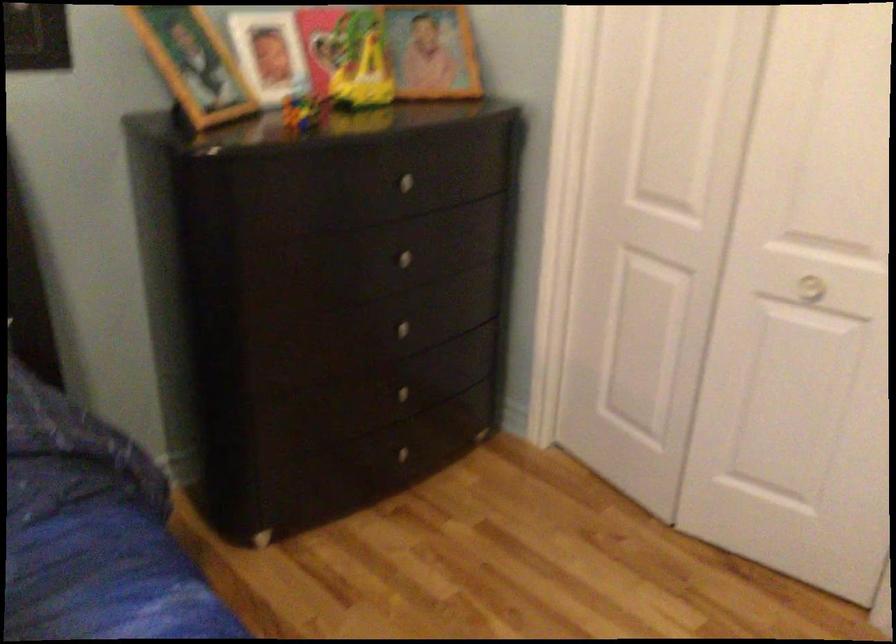
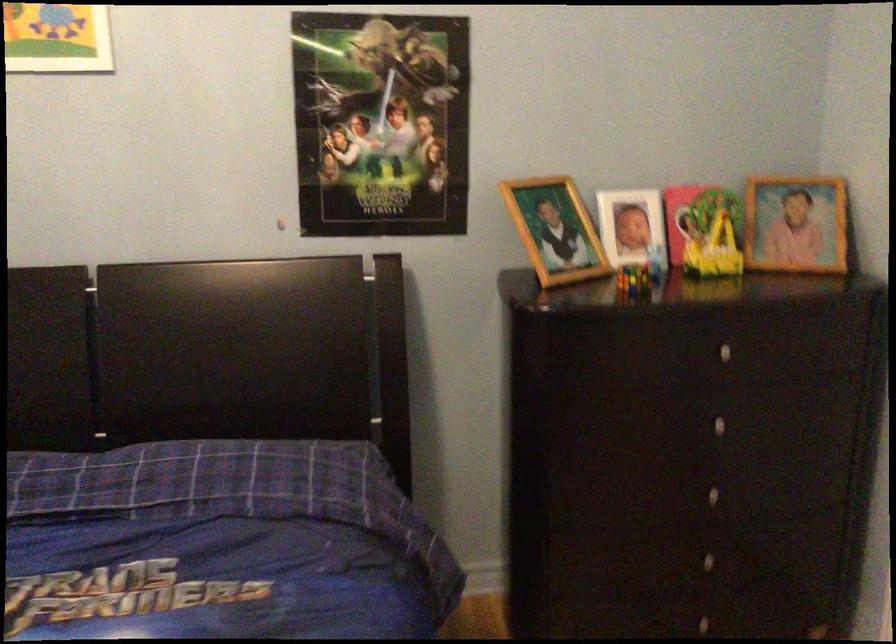
Question: I am providing you with two images of the same scene from different viewpoints. After the viewpoint changes to image2, which objects are now occluded?

Choices:
 (A) silver drawer knob
 (B) white picture frame
 (C) wooden picture frame
 (D) none of these

Answer: (D)